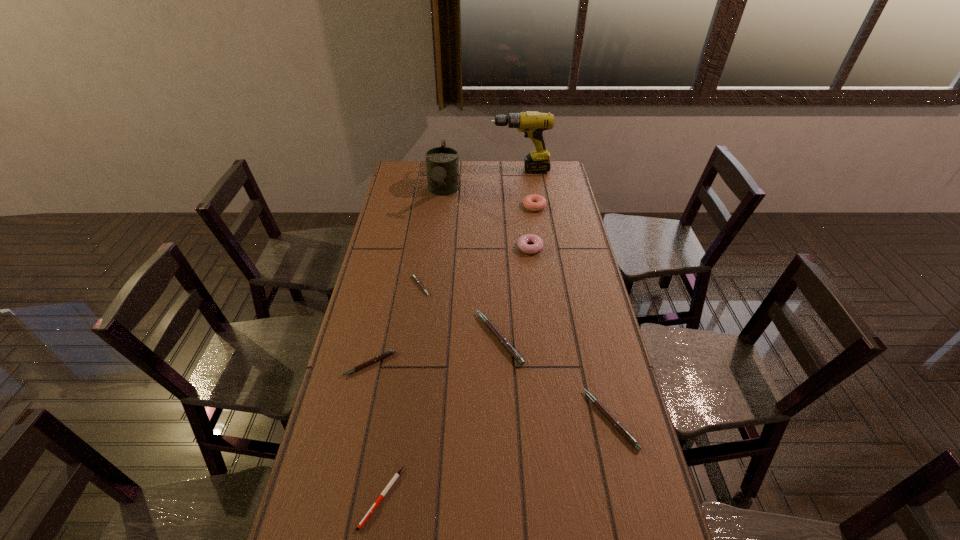
Where is `free location located 0.150m on the back of the nearer doughnut`? This screenshot has width=960, height=540. free location located 0.150m on the back of the nearer doughnut is located at coordinates (526, 219).

Where is `vacant space situated on the left of the farther doughnut`? This screenshot has width=960, height=540. vacant space situated on the left of the farther doughnut is located at coordinates (475, 206).

Find the location of a particular element. free location located at the nib of the tallest pen is located at coordinates (404, 338).

Locate an element on the screen. The height and width of the screenshot is (540, 960). vacant area situated 0.190m at the nib of the tallest pen is located at coordinates (420, 338).

This screenshot has height=540, width=960. What are the coordinates of `vacant area situated at the nib of the tallest pen` in the screenshot? It's located at (374, 338).

Image resolution: width=960 pixels, height=540 pixels. Find the location of `vacant space located at the nib of the third smallest pink pen`. vacant space located at the nib of the third smallest pink pen is located at coordinates (451, 419).

Identify the location of free space located at the nib of the third smallest pink pen. Image resolution: width=960 pixels, height=540 pixels. (535, 419).

Find the location of a particular element. This screenshot has width=960, height=540. free space located 0.360m at the nib of the third smallest pink pen is located at coordinates (461, 419).

Locate an element on the screen. Image resolution: width=960 pixels, height=540 pixels. free space located at the nib of the seventh tallest object is located at coordinates tap(362, 395).

Find the location of a particular element. This screenshot has height=540, width=960. free location located at the nib of the fifth nearest object is located at coordinates (505, 286).